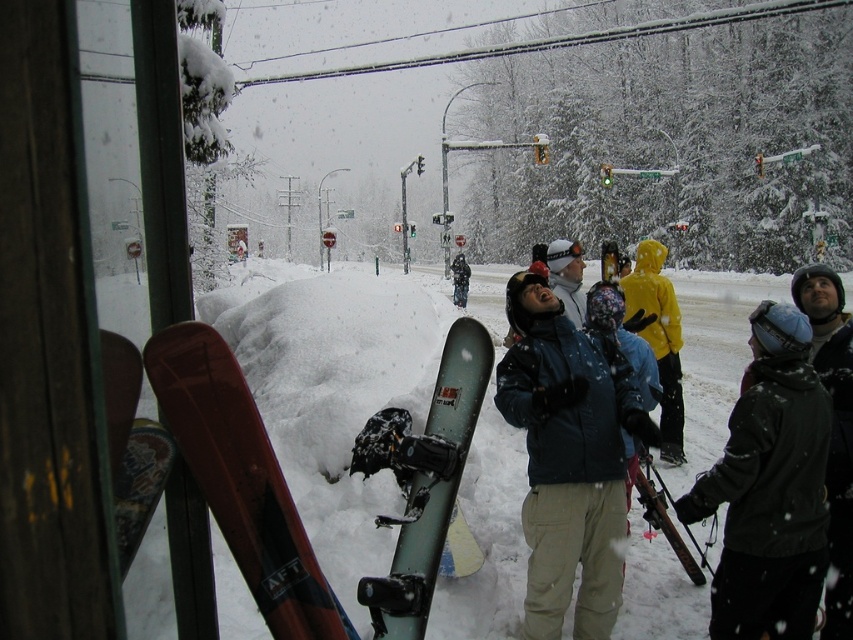
You are a snowboarder who wants to retrieve your matte red snowboard at left. You are currently standing 1.67 meters away from it. Can you reach it without moving your feet?

The matte red snowboard at left is 1.67 meters away from you. Since the average arm reach is about 1.5 meters, you might not be able to reach it without moving your feet.

Based on the coordinates provided, what is located at point (x=334, y=387) in the snowy winter scene?

The coordinates point to white fluffy snow at center.

You are standing in the snowy scene and want to take a photo of the matte blue jacket at center. However, the white fluffy snow at center is blocking your view. Can you move the snow to get a clear shot?

The white fluffy snow at center is closer to the viewer than the matte blue jacket at center, so you can move the snow to get a clear shot of the matte blue jacket at center.